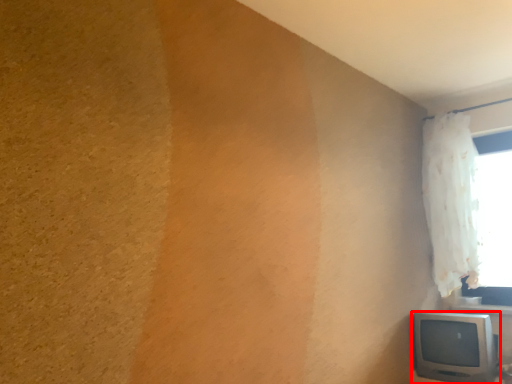
Question: Observing the image, what is the correct spatial positioning of television (annotated by the red box) in reference to window?

Choices:
 (A) left
 (B) right

Answer: (A)